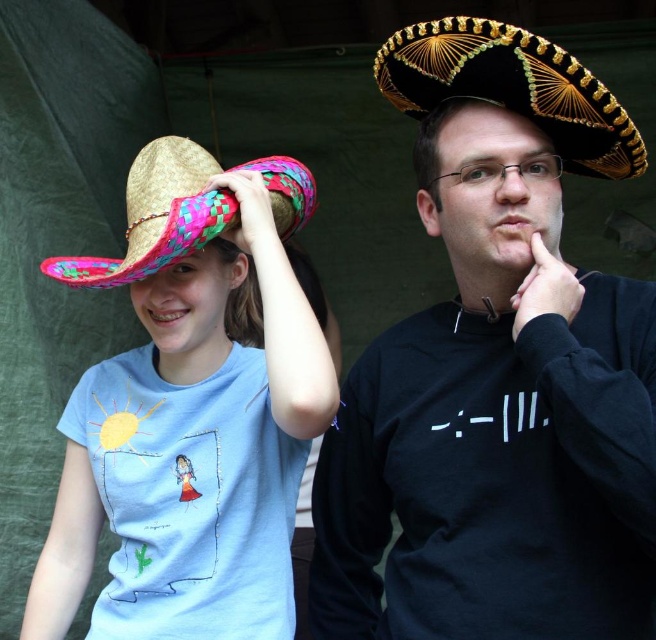
You are standing in front of the image and notice the bright straw hat at left. Can you determine its exact position using the coordinate system provided in the Objects Description?

The bright straw hat at left is located at point coordinates (190, 413).

You are a photographer setting up for a photoshoot. You need to decide which hat to use based on their thickness. The scene has two hats available. The black straw sombrero at upper right and the bright pink woven straw cowboy hat at upper left. Which hat is thinner?

The black straw sombrero at upper right is thinner than the bright pink woven straw cowboy hat at upper left.

You are planning to buy a sombrero for a sunny day. You have two options in the image. The black matte sombrero at center and the black straw sombrero at upper right. Which one would provide better shade coverage based on their sizes?

The black matte sombrero at center has a larger width than the black straw sombrero at upper right, so it would provide better shade coverage.